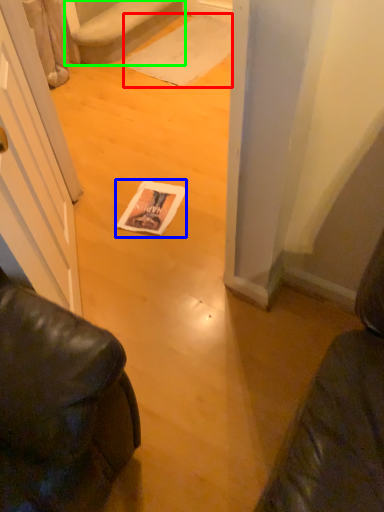
Question: Based on their relative distances, which object is farther from doormat (highlighted by a red box)? Choose from magazine (highlighted by a blue box) and stairwell (highlighted by a green box).

Choices:
 (A) magazine
 (B) stairwell

Answer: (A)